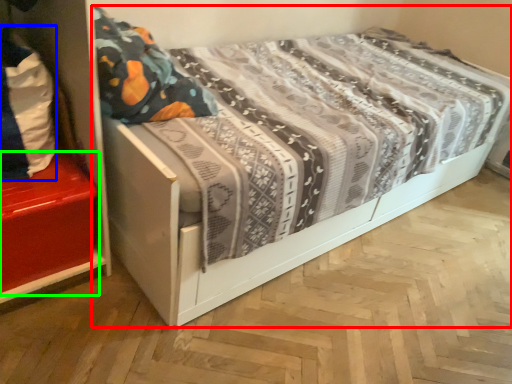
Question: Which object is positioned farthest from bed (highlighted by a red box)? Select from material (highlighted by a blue box) and shelf (highlighted by a green box).

Choices:
 (A) material
 (B) shelf

Answer: (B)